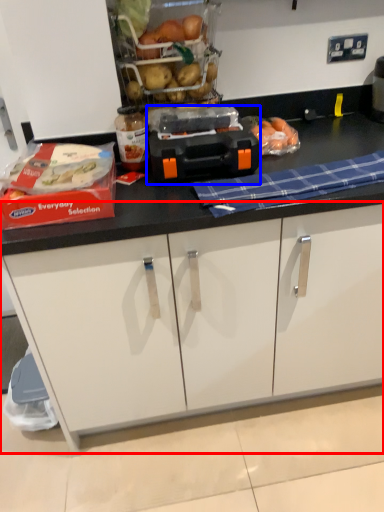
Question: Which object is further to the camera taking this photo, cabinetry (highlighted by a red box) or appliance (highlighted by a blue box)?

Choices:
 (A) cabinetry
 (B) appliance

Answer: (A)